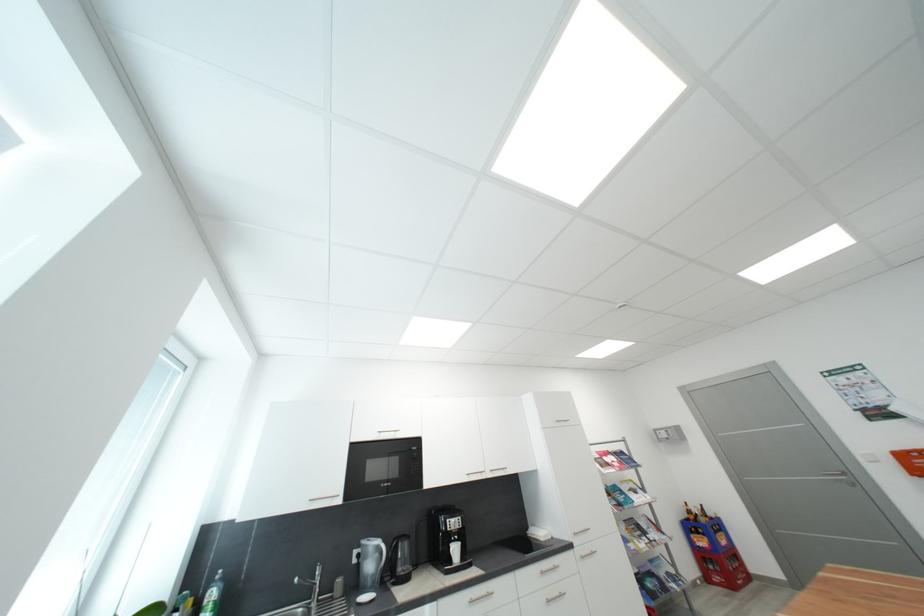
You are a GUI agent. You are given a task and a screenshot of the screen. Output one action in this format:
    pyautogui.click(x=<x>, y=<y>)
    Task: Click on the blue bottle crate
    This screenshot has width=924, height=616.
    Given the screenshot: What is the action you would take?
    pyautogui.click(x=707, y=535)